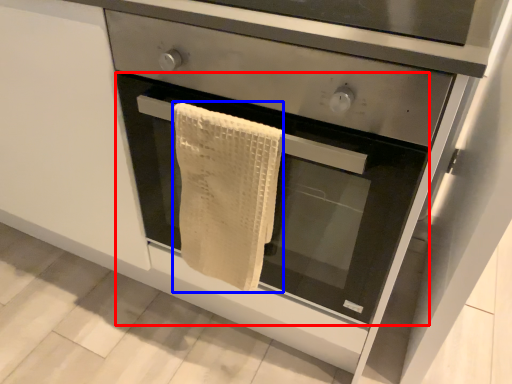
Question: Which of the following is the farthest to the observer, oven (highlighted by a red box) or bath towel (highlighted by a blue box)?

Choices:
 (A) oven
 (B) bath towel

Answer: (B)